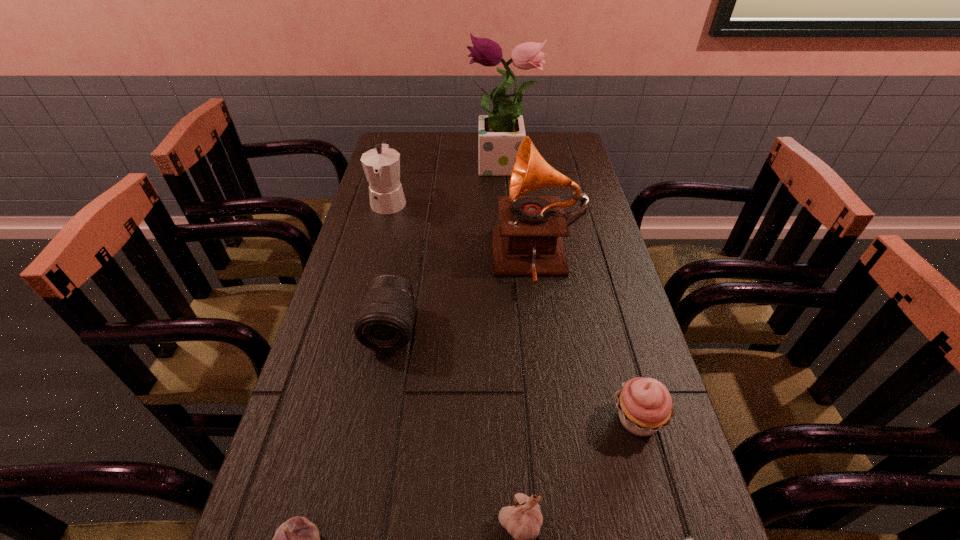
Locate an element on the screen. Image resolution: width=960 pixels, height=540 pixels. garlic that is the closest to the coffeepot is located at coordinates (297, 539).

Identify which garlic is the second closest to the second garlic from left to right. Please provide its 2D coordinates. Your answer should be formatted as a tuple, i.e. [(x, y)], where the tuple contains the x and y coordinates of a point satisfying the conditions above.

[(297, 539)]

The image size is (960, 540). I want to click on blank area in the image that satisfies the following two spatial constraints: 1. on the surface of the cupcake; 2. on the left side of the telephoto lens, so click(x=374, y=419).

Identify the location of free point that satisfies the following two spatial constraints: 1. on the horn of the cupcake; 2. on the left side of the phonograph record. This screenshot has width=960, height=540. (559, 419).

The height and width of the screenshot is (540, 960). I want to click on vacant space that satisfies the following two spatial constraints: 1. at the spout of the cupcake; 2. on the left side of the sixth shortest object, so click(x=333, y=419).

You are a GUI agent. You are given a task and a screenshot of the screen. Output one action in this format:
    pyautogui.click(x=<x>, y=<y>)
    Task: Click on the free space that satisfies the following two spatial constraints: 1. on the front-facing side of the flower arrangement; 2. on the surface of the fifth nearest object
    This screenshot has width=960, height=540.
    Given the screenshot: What is the action you would take?
    pyautogui.click(x=515, y=328)

I want to click on free space that satisfies the following two spatial constraints: 1. on the horn of the third farthest object; 2. on the back side of the fourth nearest object, so click(559, 419).